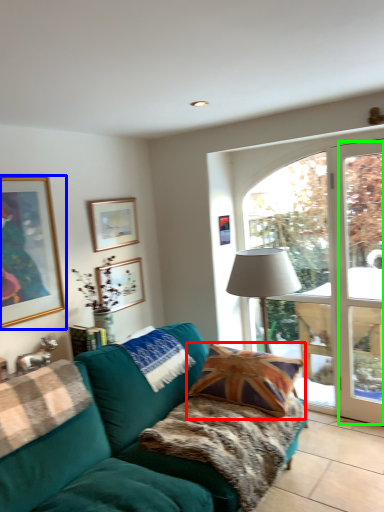
Question: Which object is the closest to the pillow (highlighted by a red box)? Choose among these: picture frame (highlighted by a blue box) or window frame (highlighted by a green box).

Choices:
 (A) picture frame
 (B) window frame

Answer: (B)